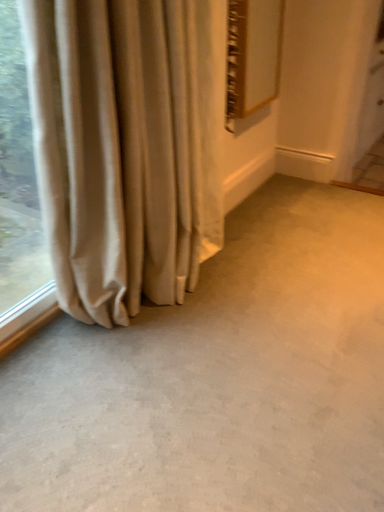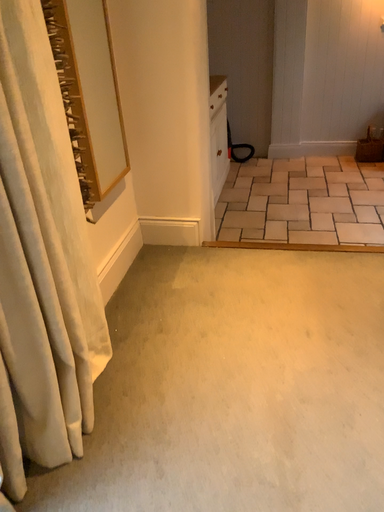
Question: Which way did the camera rotate in the video?

Choices:
 (A) rotated left
 (B) rotated right

Answer: (B)